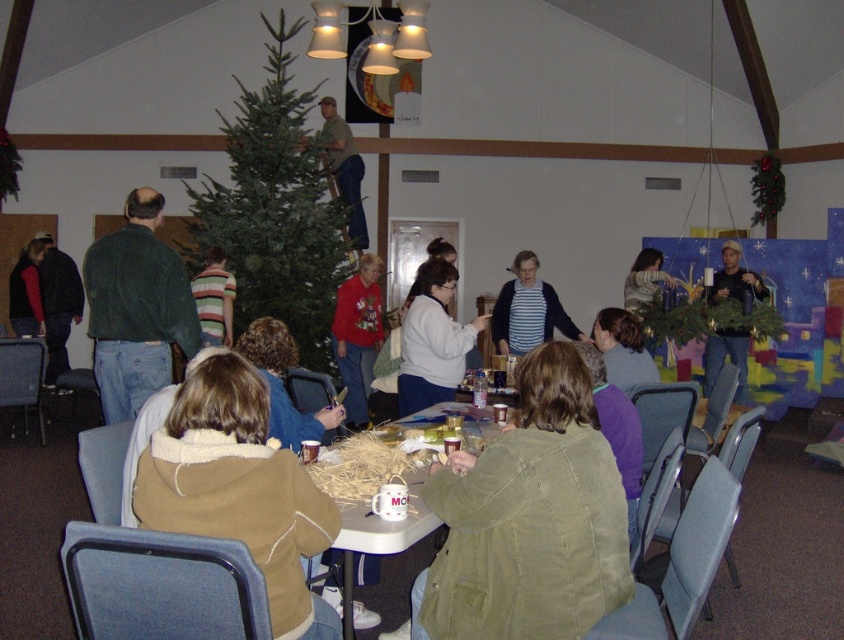
Which is above, brown fuzzy hoodie at lower left or striped cotton shirt at center?

Positioned higher is striped cotton shirt at center.

Between brown fuzzy hoodie at lower left and striped cotton shirt at center, which one appears on the right side from the viewer's perspective?

striped cotton shirt at center

Which is in front, point (337, 628) or point (498, 320)?

Point (337, 628) is more forward.

Where is `brown fuzzy hoodie at lower left`? brown fuzzy hoodie at lower left is located at coordinates (237, 486).

Is camouflage fabric shirt at upper center to the left of matte black jacket at lower left from the viewer's perspective?

No, camouflage fabric shirt at upper center is not to the left of matte black jacket at lower left.

Based on the photo, between camouflage fabric shirt at upper center and matte black jacket at lower left, which one appears on the right side from the viewer's perspective?

Positioned to the right is camouflage fabric shirt at upper center.

Does point (349, 148) come in front of point (42, 330)?

No, it is not.

The width and height of the screenshot is (844, 640). I want to click on camouflage fabric shirt at upper center, so click(x=344, y=170).

What do you see at coordinates (528, 518) in the screenshot?
I see `khaki cotton jacket at lower center` at bounding box center [528, 518].

Does khaki cotton jacket at lower center appear under matte black jacket at lower left?

Yes.

Measure the distance between khaki cotton jacket at lower center and camera.

They are 2.05 meters apart.

You are a GUI agent. You are given a task and a screenshot of the screen. Output one action in this format:
    pyautogui.click(x=<x>, y=<y>)
    Task: Click on the khaki cotton jacket at lower center
    This screenshot has height=640, width=844.
    Given the screenshot: What is the action you would take?
    pyautogui.click(x=528, y=518)